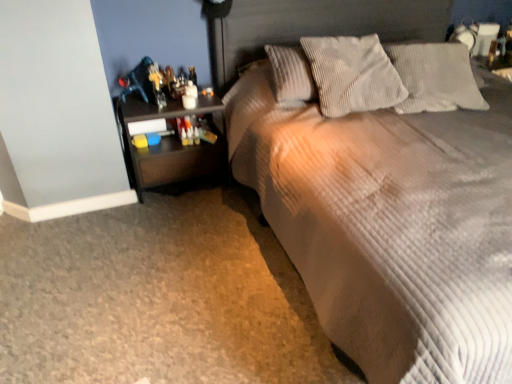
Question: From their relative heights in the image, would you say dark wood nightstand at left is taller or shorter than corduroy fabric bed at center?

Choices:
 (A) short
 (B) tall

Answer: (A)

Question: In the image, is dark wood nightstand at left positioned in front of or behind corduroy fabric bed at center?

Choices:
 (A) behind
 (B) front

Answer: (A)

Question: Which object is positioned farthest from the corduroy fabric bed at center?

Choices:
 (A) corduroy pillow at upper center, which is the second pillow from right to left
 (B) dark wood nightstand at left
 (C) gray corduroy pillow at upper center, the 2th pillow when ordered from left to right

Answer: (B)

Question: Considering the real-world distances, which object is farthest from the corduroy pillow at upper center, which is the second pillow from right to left?

Choices:
 (A) dark wood nightstand at left
 (B) gray corduroy pillow at upper center, which is the first pillow from right to left
 (C) corduroy fabric bed at center

Answer: (A)